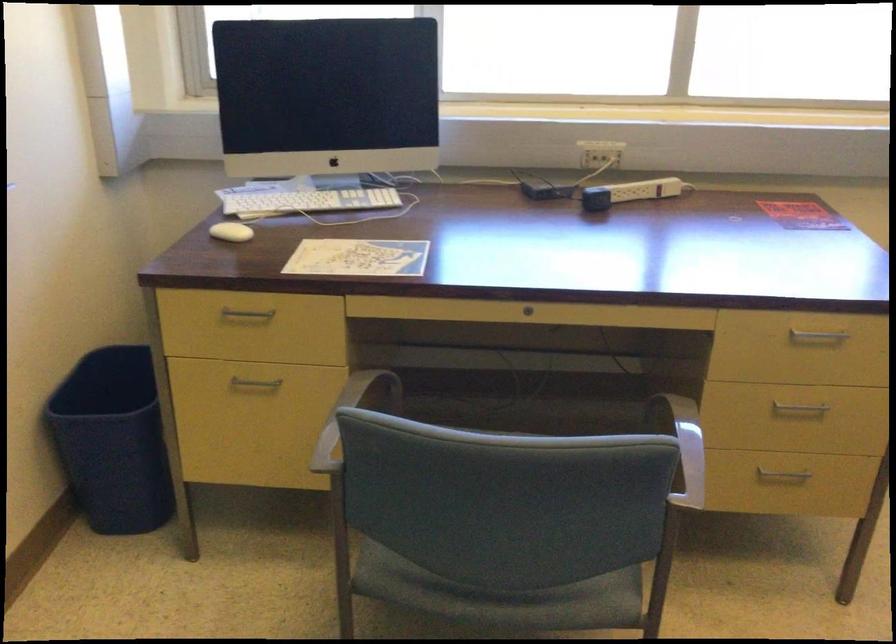
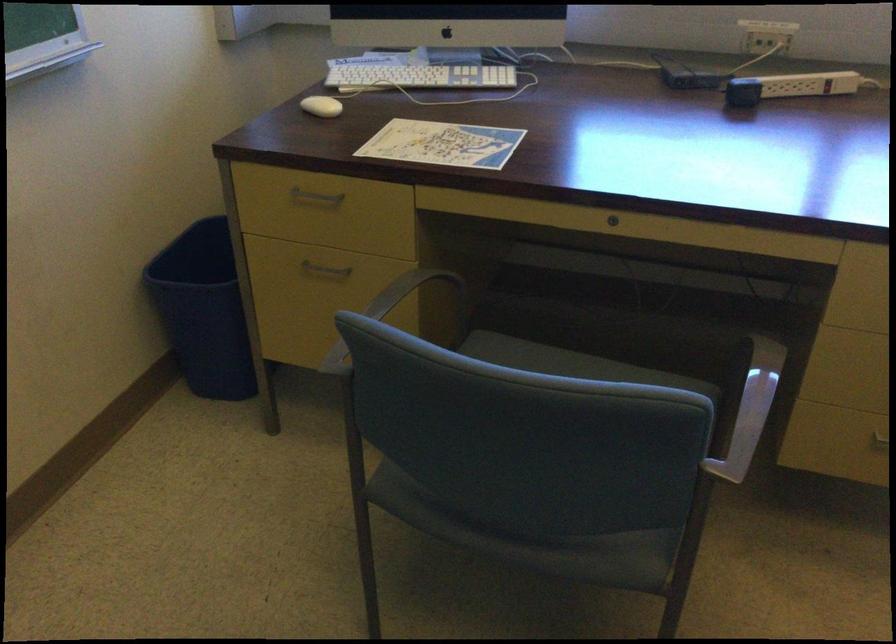
In the second image, find the point that corresponds to (250,314) in the first image.

(315, 196)